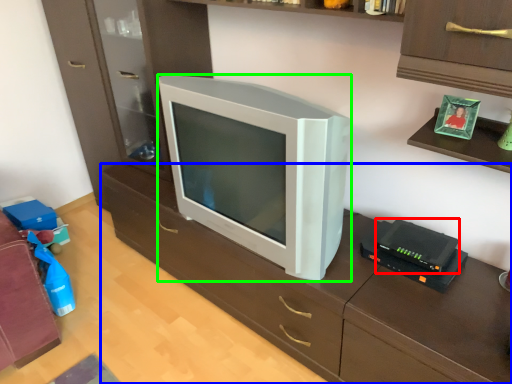
Question: Which object is positioned closest to gadget (highlighted by a red box)? Select from computer desk (highlighted by a blue box) and television (highlighted by a green box).

Choices:
 (A) computer desk
 (B) television

Answer: (A)